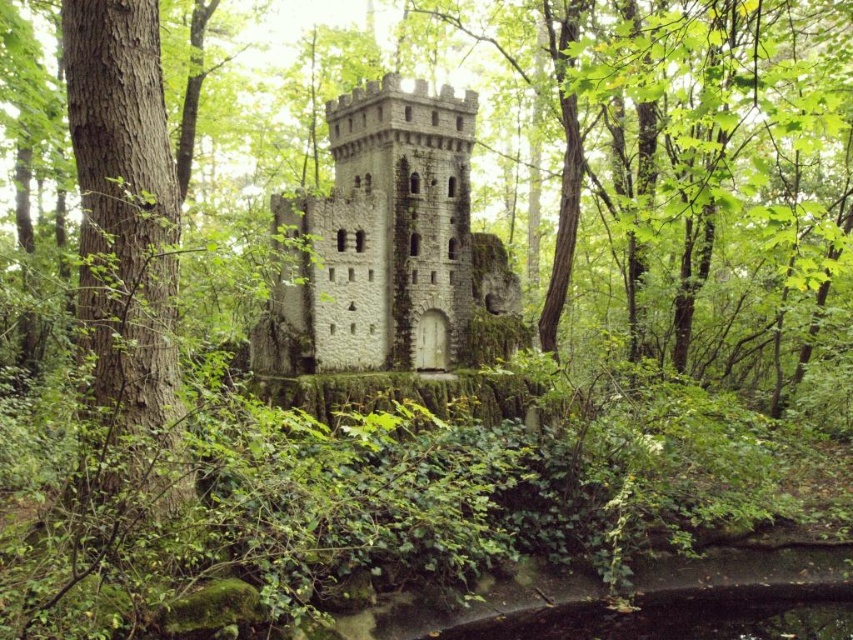
Question: Is stone tower at center smaller than brown rough bark tree at left?

Choices:
 (A) no
 (B) yes

Answer: (A)

Question: Does stone tower at center appear on the right side of brown rough bark tree at left?

Choices:
 (A) no
 (B) yes

Answer: (B)

Question: Among these objects, which one is farthest from the camera?

Choices:
 (A) brown rough bark tree at left
 (B) stone tower at center

Answer: (B)

Question: Observing the image, what is the correct spatial positioning of stone tower at center in reference to brown rough bark tree at left?

Choices:
 (A) left
 (B) right

Answer: (B)